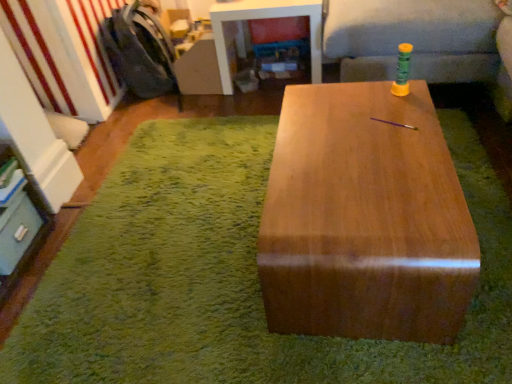
Question: In terms of height, does dark gray fabric armchair at left look taller or shorter compared to green fabric couch at upper right?

Choices:
 (A) short
 (B) tall

Answer: (A)

Question: Is dark gray fabric armchair at left wider or thinner than green fabric couch at upper right?

Choices:
 (A) thin
 (B) wide

Answer: (A)

Question: Considering the real-world distances, which object is farthest from the wooden table at center?

Choices:
 (A) satin wood table at center, arranged as the 1th table when ordered from the bottom
 (B) glossy wood table at center, which ranks as the 2th table in bottom-to-top order
 (C) green fabric couch at upper right
 (D) dark gray fabric armchair at left
 (E) matte gray drawer at lower left

Answer: (D)

Question: Based on their relative distances, which object is nearer to the dark gray fabric armchair at left?

Choices:
 (A) satin wood table at center, acting as the 2th table starting from the top
 (B) wooden table at center
 (C) matte gray drawer at lower left
 (D) glossy wood table at center, which is counted as the 2th table, starting from the front
 (E) green fabric couch at upper right

Answer: (D)